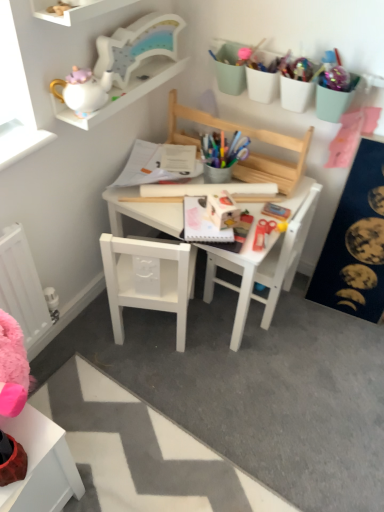
What do you see at coordinates (355, 242) in the screenshot? I see `dark blue fabric bulletin board at right` at bounding box center [355, 242].

The width and height of the screenshot is (384, 512). Find the location of `white wooden table at center`. white wooden table at center is located at coordinates (265, 257).

The width and height of the screenshot is (384, 512). What do you see at coordinates (83, 90) in the screenshot?
I see `white glossy teapot at upper left, the first stationery positioned from the front` at bounding box center [83, 90].

This screenshot has height=512, width=384. I want to click on white matte chair at lower left, placed as the 2th chair when sorted from right to left, so click(x=161, y=280).

Identify the location of dark blue fabric bulletin board at right. The height and width of the screenshot is (512, 384). (355, 242).

Which object is wider, white wooden table at center or pastel green plastic containers at upper right, the second stationery from the front?

With larger width is white wooden table at center.

In the image, is white wooden table at center on the left side or the right side of pastel green plastic containers at upper right, the second stationery from the front?

white wooden table at center is to the left of pastel green plastic containers at upper right, the second stationery from the front.

Which of these two, white wooden table at center or pastel green plastic containers at upper right, the 1th stationery from the back, stands shorter?

Standing shorter between the two is pastel green plastic containers at upper right, the 1th stationery from the back.

Considering the relative sizes of white wooden table at center and pastel green plastic containers at upper right, positioned as the 2th stationery in left-to-right order, in the image provided, is white wooden table at center smaller than pastel green plastic containers at upper right, positioned as the 2th stationery in left-to-right order,?

Actually, white wooden table at center might be larger than pastel green plastic containers at upper right, positioned as the 2th stationery in left-to-right order.

Can you confirm if white wooden chair at center, which is the second chair from left to right, is shorter than dark blue fabric bulletin board at right?

Correct, white wooden chair at center, which is the second chair from left to right, is not as tall as dark blue fabric bulletin board at right.

Is white wooden chair at center, which is the second chair from left to right, at the left side of dark blue fabric bulletin board at right?

Indeed, white wooden chair at center, which is the second chair from left to right, is positioned on the left side of dark blue fabric bulletin board at right.

Considering the relative sizes of white wooden chair at center, arranged as the 1th chair when viewed from the right, and dark blue fabric bulletin board at right in the image provided, is white wooden chair at center, arranged as the 1th chair when viewed from the right, thinner than dark blue fabric bulletin board at right?

In fact, white wooden chair at center, arranged as the 1th chair when viewed from the right, might be wider than dark blue fabric bulletin board at right.

Which is correct: white matte chair at lower left, placed as the 2th chair when sorted from right to left, is inside dark blue fabric bulletin board at right, or outside of it?

white matte chair at lower left, placed as the 2th chair when sorted from right to left, exists outside the volume of dark blue fabric bulletin board at right.

Is white matte chair at lower left, the 1th chair from the left, positioned in front of dark blue fabric bulletin board at right?

No.

From a real-world perspective, is white matte chair at lower left, placed as the 2th chair when sorted from right to left, physically located above or below dark blue fabric bulletin board at right?

white matte chair at lower left, placed as the 2th chair when sorted from right to left, is below dark blue fabric bulletin board at right.

Could you tell me if white matte chair at lower left, placed as the 2th chair when sorted from right to left, is facing dark blue fabric bulletin board at right?

No, white matte chair at lower left, placed as the 2th chair when sorted from right to left, is not aimed at dark blue fabric bulletin board at right.

Is point (347, 199) positioned after point (70, 7)?

That is True.

Between dark blue fabric bulletin board at right and white wooden shelf at upper left, placed as the second shelf when sorted from back to front, which one has more height?

With more height is dark blue fabric bulletin board at right.

Which shelf is the 2nd one when counting from the front of the dark blue fabric bulletin board at right? Please provide its 2D coordinates.

[(75, 10)]

Is white wooden table at center inside or outside of dark blue fabric bulletin board at right?

white wooden table at center is outside dark blue fabric bulletin board at right.

From their relative heights in the image, would you say white wooden table at center is taller or shorter than dark blue fabric bulletin board at right?

Considering their sizes, white wooden table at center has less height than dark blue fabric bulletin board at right.

I want to click on table that appears on the left of dark blue fabric bulletin board at right, so point(265,257).

In terms of width, does white wooden table at center look wider or thinner when compared to dark blue fabric bulletin board at right?

Clearly, white wooden table at center has more width compared to dark blue fabric bulletin board at right.

Is the surface of white glossy teapot at upper left, the first shelf positioned from the back, in direct contact with white wooden shelf at upper left, which is the 1th shelf from front to back?

No, white glossy teapot at upper left, the first shelf positioned from the back, is not with white wooden shelf at upper left, which is the 1th shelf from front to back.

Is white glossy teapot at upper left, the second shelf in the front-to-back sequence, positioned beyond the bounds of white wooden shelf at upper left, placed as the second shelf when sorted from back to front?

Yes.

Does white glossy teapot at upper left, the second shelf in the front-to-back sequence, come behind white wooden shelf at upper left, placed as the second shelf when sorted from back to front?

That is True.

Which of these two, white glossy teapot at upper left, the second shelf in the front-to-back sequence, or white wooden shelf at upper left, which is the 1th shelf from front to back, is wider?

white glossy teapot at upper left, the second shelf in the front-to-back sequence, is wider.

In terms of width, does white wooden chair at center, arranged as the 1th chair when viewed from the right, look wider or thinner when compared to white wooden table at center?

Considering their sizes, white wooden chair at center, arranged as the 1th chair when viewed from the right, looks slimmer than white wooden table at center.

Is white wooden chair at center, which is the second chair from left to right, directly adjacent to white wooden table at center?

Absolutely, white wooden chair at center, which is the second chair from left to right, is next to and touching white wooden table at center.

Based on the photo, is white wooden table at center completely or partially inside white wooden chair at center, which is the second chair from left to right?

No, white wooden table at center is not surrounded by white wooden chair at center, which is the second chair from left to right.

How distant is white wooden chair at center, arranged as the 1th chair when viewed from the right, from white wooden table at center?

white wooden chair at center, arranged as the 1th chair when viewed from the right, is 1.97 inches from white wooden table at center.

Where is `the 2nd stationery above the white wooden table at center (from the image's perspective)`? the 2nd stationery above the white wooden table at center (from the image's perspective) is located at coordinates (307, 89).

The image size is (384, 512). I want to click on the 2nd chair behind when counting from the dark blue fabric bulletin board at right, so click(x=263, y=265).

Estimate the real-world distances between objects in this image. Which object is closer to pastel green plastic containers at upper right, the 1th stationery from the back, white glossy teapot at upper left, which appears as the second stationery when viewed from the right, or white wooden table at center?

white wooden table at center is positioned closer to the anchor pastel green plastic containers at upper right, the 1th stationery from the back.

From the image, which object appears to be farther from white matte chair at lower left, the 1th chair from the left, dark blue fabric bulletin board at right or pastel green plastic containers at upper right, positioned as the 2th stationery in left-to-right order?

pastel green plastic containers at upper right, positioned as the 2th stationery in left-to-right order, is positioned further to the anchor white matte chair at lower left, the 1th chair from the left.

Based on their spatial positions, is pastel green plastic containers at upper right, the 1th stationery from the back, or white wooden shelf at upper left, which is the 1th shelf from front to back, further from white matte chair at lower left, the 1th chair from the left?

Based on the image, white wooden shelf at upper left, which is the 1th shelf from front to back, appears to be further to white matte chair at lower left, the 1th chair from the left.

Looking at the image, which one is located closer to pastel green plastic containers at upper right, the 1th stationery from the back, white glossy teapot at upper left, the second stationery positioned from the back, or dark blue fabric bulletin board at right?

dark blue fabric bulletin board at right lies closer to pastel green plastic containers at upper right, the 1th stationery from the back, than the other object.

When comparing their distances from white wooden shelf at upper left, which is the 1th shelf from front to back, does pastel green plastic containers at upper right, positioned as the 2th stationery in left-to-right order, or dark blue fabric bulletin board at right seem further?

dark blue fabric bulletin board at right is positioned further to the anchor white wooden shelf at upper left, which is the 1th shelf from front to back.

Which object lies further to the anchor point pastel green plastic containers at upper right, marked as the 1th stationery in a right-to-left arrangement, white wooden table at center or white wooden chair at center, arranged as the 1th chair when viewed from the right?

white wooden table at center is further to pastel green plastic containers at upper right, marked as the 1th stationery in a right-to-left arrangement.

Based on their spatial positions, is pastel green plastic containers at upper right, the 1th stationery from the back, or white glossy teapot at upper left, the first stationery positioned from the front, closer to white glossy teapot at upper left, the first shelf positioned from the back?

Among the two, white glossy teapot at upper left, the first stationery positioned from the front, is located nearer to white glossy teapot at upper left, the first shelf positioned from the back.

Considering their positions, is white matte chair at lower left, the 1th chair from the left, positioned closer to pastel green plastic containers at upper right, the 1th stationery from the back, than white wooden chair at center, which is the second chair from left to right?

white wooden chair at center, which is the second chair from left to right.

Find the location of `chair that lies between pastel green plastic containers at upper right, the second stationery from the front, and white matte chair at lower left, placed as the 2th chair when sorted from right to left, from top to bottom`. chair that lies between pastel green plastic containers at upper right, the second stationery from the front, and white matte chair at lower left, placed as the 2th chair when sorted from right to left, from top to bottom is located at coordinates (263, 265).

Locate an element on the screen. This screenshot has height=512, width=384. table between white glossy teapot at upper left, the first shelf positioned from the back, and white wooden chair at center, which is the second chair from left to right, in the vertical direction is located at coordinates click(265, 257).

Find the location of a particular element. The height and width of the screenshot is (512, 384). stationery between white glossy teapot at upper left, the second shelf in the front-to-back sequence, and white wooden table at center, in the vertical direction is located at coordinates (83, 90).

This screenshot has width=384, height=512. What are the coordinates of `table between white glossy teapot at upper left, the second stationery positioned from the back, and dark blue fabric bulletin board at right from left to right` in the screenshot? It's located at (265, 257).